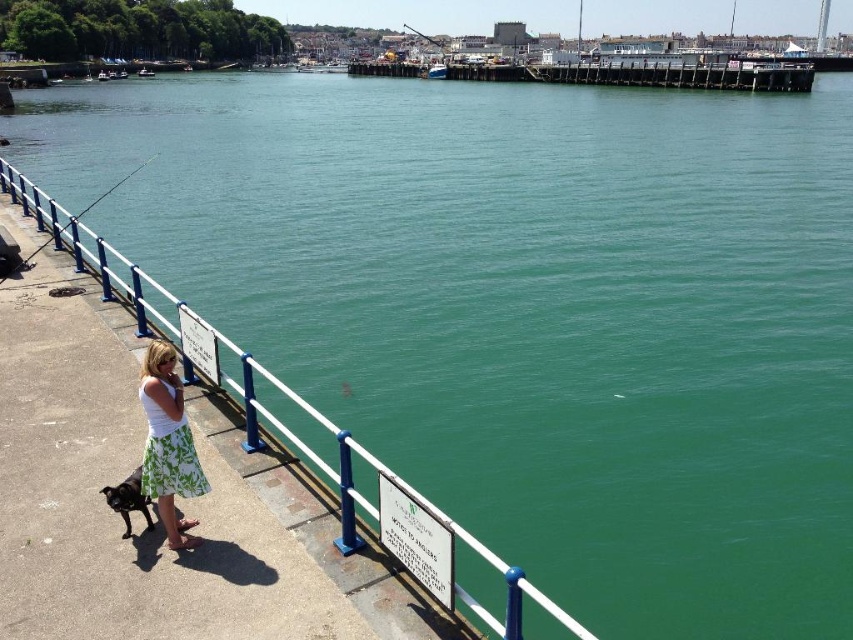
Can you confirm if black glossy dog at lower left is positioned above metallic fishing pole at upper center?

Incorrect, black glossy dog at lower left is not positioned above metallic fishing pole at upper center.

Does black glossy dog at lower left have a greater width compared to metallic fishing pole at upper center?

No.

Locate an element on the screen. This screenshot has width=853, height=640. black glossy dog at lower left is located at coordinates (128, 499).

Consider the image. Between green floral skirt at lower left and black glossy dog at lower left, which one has more height?

green floral skirt at lower left is taller.

From the picture: Can you confirm if green floral skirt at lower left is positioned to the right of black glossy dog at lower left?

Correct, you'll find green floral skirt at lower left to the right of black glossy dog at lower left.

Locate an element on the screen. green floral skirt at lower left is located at coordinates (167, 451).

Find the location of a particular element. This screenshot has height=640, width=853. green floral skirt at lower left is located at coordinates (167, 451).

Which of these two, black glossy dog at lower left or metallic fishing pole at left, stands taller?

Standing taller between the two is metallic fishing pole at left.

Does black glossy dog at lower left appear on the left side of metallic fishing pole at left?

Incorrect, black glossy dog at lower left is not on the left side of metallic fishing pole at left.

In order to click on black glossy dog at lower left in this screenshot , I will do `click(128, 499)`.